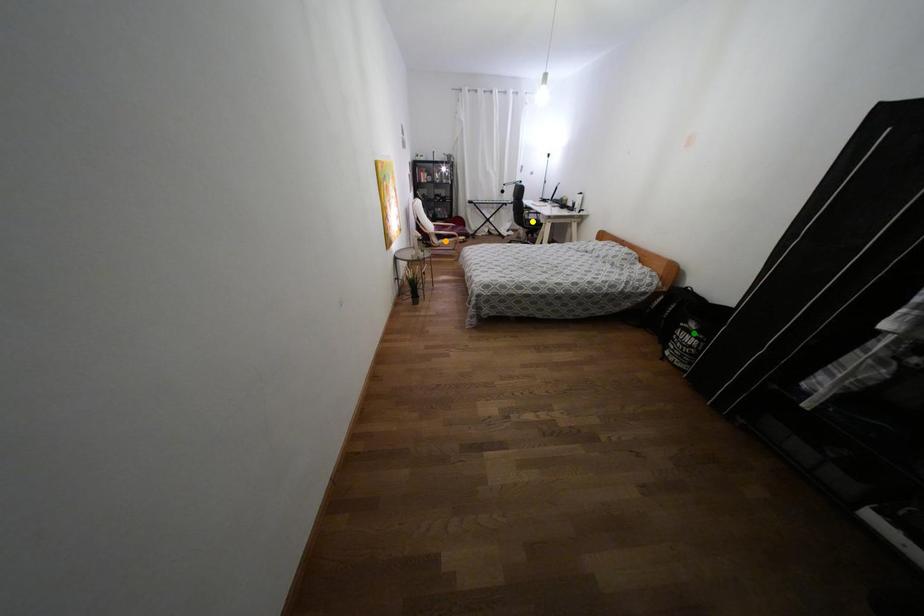
Order these from nearest to farthest:
yellow point | orange point | green point

green point → orange point → yellow point